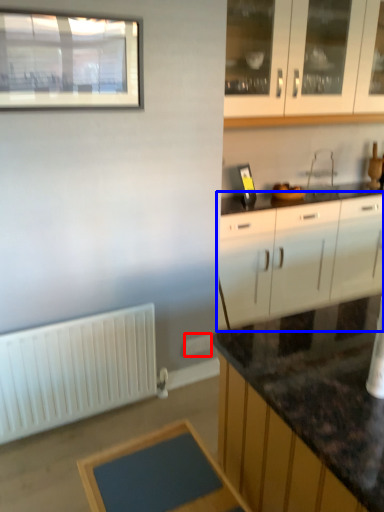
Question: Which of the following is the closest to the observer, electric outlet (highlighted by a red box) or cabinetry (highlighted by a blue box)?

Choices:
 (A) electric outlet
 (B) cabinetry

Answer: (A)